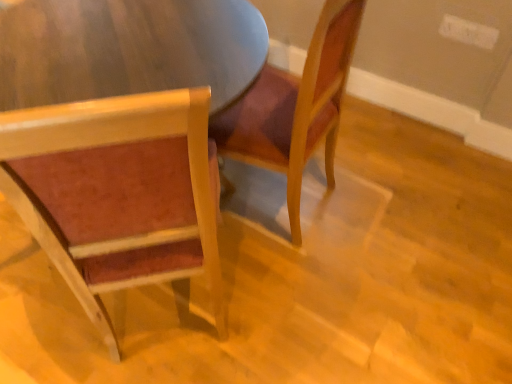
Locate an element on the screen. This screenshot has height=384, width=512. free space in front of velvet-like red chair at center, the 2th chair positioned from the left is located at coordinates (306, 299).